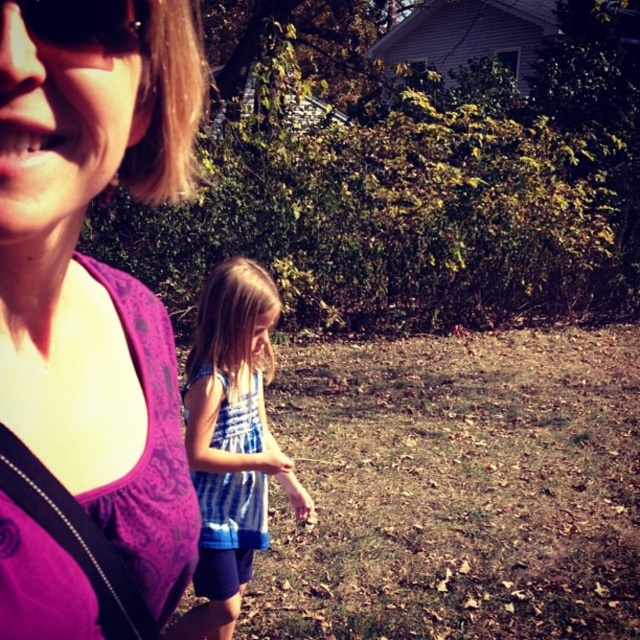
Does purple fabric at upper left appear over blue striped dress at center?

Yes.

Does purple fabric at upper left have a smaller size compared to blue striped dress at center?

Yes, purple fabric at upper left is smaller than blue striped dress at center.

Between point (60, 596) and point (216, 522), which one is positioned behind?

Positioned behind is point (216, 522).

This screenshot has height=640, width=640. I want to click on purple fabric at upper left, so click(x=90, y=317).

Does purple fabric at upper left lie behind matte black sunglasses at upper left?

No.

Is purple fabric at upper left closer to the viewer compared to matte black sunglasses at upper left?

Yes.

Who is more forward, (128, 557) or (54, 3)?

Point (54, 3) is more forward.

At what (x,y) coordinates should I click in order to perform the action: click on purple fabric at upper left. Please return your answer as a coordinate pair (x, y). Image resolution: width=640 pixels, height=640 pixels. Looking at the image, I should click on (90, 317).

At what (x,y) coordinates should I click in order to perform the action: click on blue striped dress at center. Please return your answer as a coordinate pair (x, y). The image size is (640, 640). Looking at the image, I should click on (230, 442).

Can you confirm if blue striped dress at center is shorter than matte black sunglasses at upper left?

Result: No, blue striped dress at center is not shorter than matte black sunglasses at upper left.

Is point (305, 508) positioned before point (120, 6)?

No, it is behind (120, 6).

This screenshot has width=640, height=640. What are the coordinates of `blue striped dress at center` in the screenshot? It's located at (230, 442).